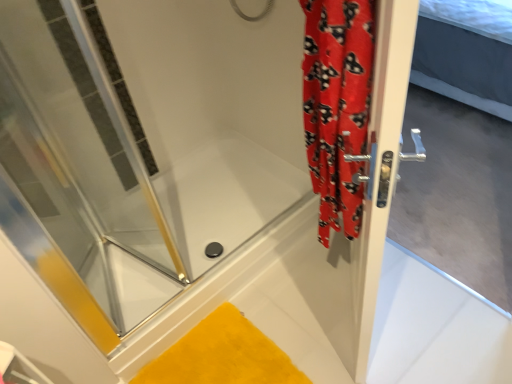
Question: Is red fabric shower curtain at right to the right of silver metallic door handle at right from the viewer's perspective?

Choices:
 (A) no
 (B) yes

Answer: (A)

Question: Is red fabric shower curtain at right smaller than silver metallic door handle at right?

Choices:
 (A) yes
 (B) no

Answer: (A)

Question: From the image's perspective, is red fabric shower curtain at right located above silver metallic door handle at right?

Choices:
 (A) no
 (B) yes

Answer: (B)

Question: Is red fabric shower curtain at right placed right next to silver metallic door handle at right?

Choices:
 (A) yes
 (B) no

Answer: (B)

Question: Is red fabric shower curtain at right taller than silver metallic door handle at right?

Choices:
 (A) no
 (B) yes

Answer: (A)

Question: Based on their positions, is silver metallic door handle at right located to the left or right of yellow plush bath mat at lower center?

Choices:
 (A) left
 (B) right

Answer: (B)

Question: From the image's perspective, is silver metallic door handle at right located above or below yellow plush bath mat at lower center?

Choices:
 (A) above
 (B) below

Answer: (A)

Question: Is silver metallic door handle at right inside the boundaries of yellow plush bath mat at lower center, or outside?

Choices:
 (A) outside
 (B) inside

Answer: (A)

Question: Considering the positions of silver metallic door handle at right and yellow plush bath mat at lower center in the image, is silver metallic door handle at right taller or shorter than yellow plush bath mat at lower center?

Choices:
 (A) short
 (B) tall

Answer: (B)

Question: From a real-world perspective, is transparent glass shower door at left physically located above or below silver metallic door handle at right?

Choices:
 (A) below
 (B) above

Answer: (B)

Question: Based on their sizes in the image, would you say transparent glass shower door at left is bigger or smaller than silver metallic door handle at right?

Choices:
 (A) small
 (B) big

Answer: (A)

Question: From the image's perspective, is transparent glass shower door at left positioned above or below silver metallic door handle at right?

Choices:
 (A) below
 (B) above

Answer: (B)

Question: Is transparent glass shower door at left taller or shorter than silver metallic door handle at right?

Choices:
 (A) short
 (B) tall

Answer: (A)

Question: From the image's perspective, is yellow plush bath mat at lower center positioned above or below red fabric shower curtain at right?

Choices:
 (A) below
 (B) above

Answer: (A)

Question: Considering the positions of yellow plush bath mat at lower center and red fabric shower curtain at right in the image, is yellow plush bath mat at lower center taller or shorter than red fabric shower curtain at right?

Choices:
 (A) tall
 (B) short

Answer: (B)